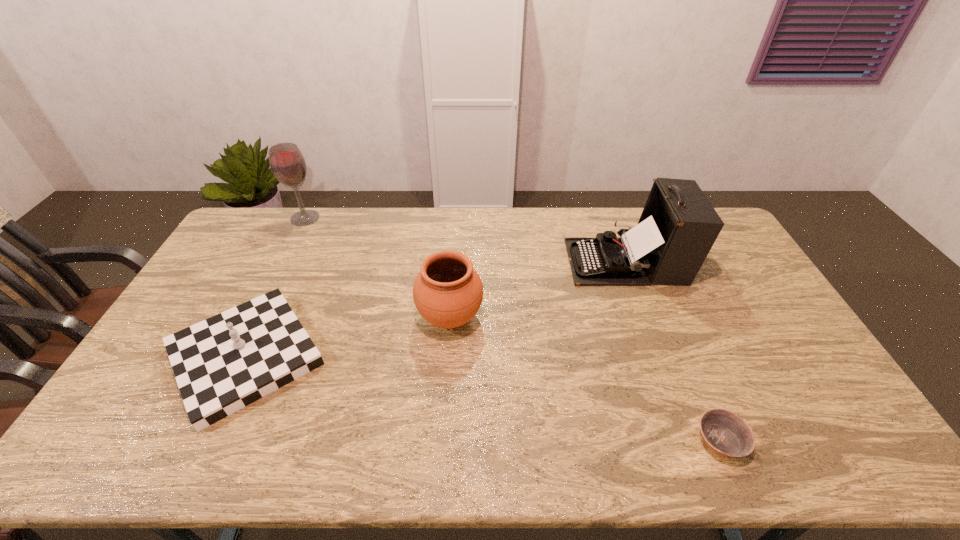
Identify the location of free region located 0.390m on the left of the third object from left to right. The image size is (960, 540). (291, 318).

Identify the location of free space located 0.180m on the right of the checkerboard. The height and width of the screenshot is (540, 960). (391, 356).

The width and height of the screenshot is (960, 540). Identify the location of free spot located 0.390m on the back of the shortest object. (664, 305).

Locate an element on the screen. This screenshot has width=960, height=540. alcohol at the far edge is located at coordinates (287, 163).

The width and height of the screenshot is (960, 540). I want to click on typewriter at the far edge, so click(x=678, y=226).

Identify the location of checkerboard located at the near edge. Image resolution: width=960 pixels, height=540 pixels. (222, 364).

Where is `bowl located in the near edge section of the desktop`? This screenshot has width=960, height=540. bowl located in the near edge section of the desktop is located at coordinates (723, 431).

Locate an element on the screen. Image resolution: width=960 pixels, height=540 pixels. object located at the left edge is located at coordinates (222, 364).

Where is `object that is positioned at the near left corner`? object that is positioned at the near left corner is located at coordinates (222, 364).

Identify the location of vacant space at the far edge. This screenshot has height=540, width=960. (405, 222).